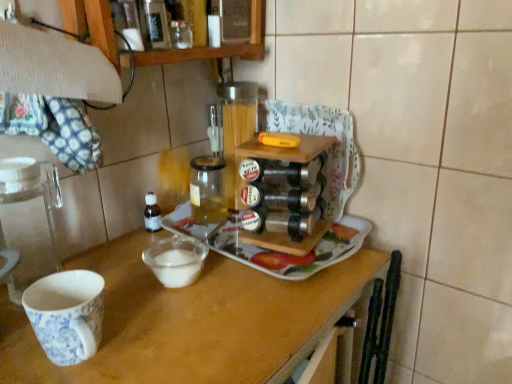
Question: Does porcelain cup at left have a larger size compared to wooden shelf at upper left?

Choices:
 (A) no
 (B) yes

Answer: (A)

Question: Does porcelain cup at left have a lesser height compared to wooden shelf at upper left?

Choices:
 (A) yes
 (B) no

Answer: (B)

Question: Is porcelain cup at left oriented towards wooden shelf at upper left?

Choices:
 (A) yes
 (B) no

Answer: (B)

Question: Does porcelain cup at left have a greater height compared to wooden shelf at upper left?

Choices:
 (A) no
 (B) yes

Answer: (B)

Question: Does porcelain cup at left lie behind wooden shelf at upper left?

Choices:
 (A) yes
 (B) no

Answer: (B)

Question: Is the depth of porcelain cup at left less than that of wooden shelf at upper left?

Choices:
 (A) no
 (B) yes

Answer: (B)

Question: Can you confirm if white ceramic tray at center is thinner than wooden shelf at upper left?

Choices:
 (A) yes
 (B) no

Answer: (B)

Question: Can you confirm if white ceramic tray at center is positioned to the left of wooden shelf at upper left?

Choices:
 (A) yes
 (B) no

Answer: (B)

Question: Is white ceramic tray at center positioned before wooden shelf at upper left?

Choices:
 (A) yes
 (B) no

Answer: (B)

Question: Is white ceramic tray at center far away from wooden shelf at upper left?

Choices:
 (A) no
 (B) yes

Answer: (A)

Question: Can you confirm if white ceramic tray at center is bigger than wooden shelf at upper left?

Choices:
 (A) yes
 (B) no

Answer: (B)

Question: Does white ceramic tray at center have a greater width compared to wooden shelf at upper left?

Choices:
 (A) yes
 (B) no

Answer: (A)

Question: Does translucent glass jar at center lie in front of white ceramic tray at center?

Choices:
 (A) no
 (B) yes

Answer: (A)